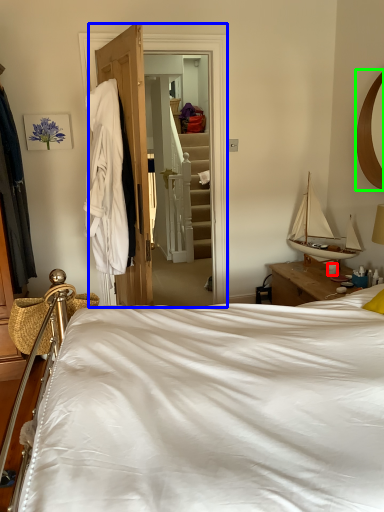
Question: Which object is the farthest from coffee cup (highlighted by a red box)? Choose among these: closet (highlighted by a blue box) or mirror (highlighted by a green box).

Choices:
 (A) closet
 (B) mirror

Answer: (A)